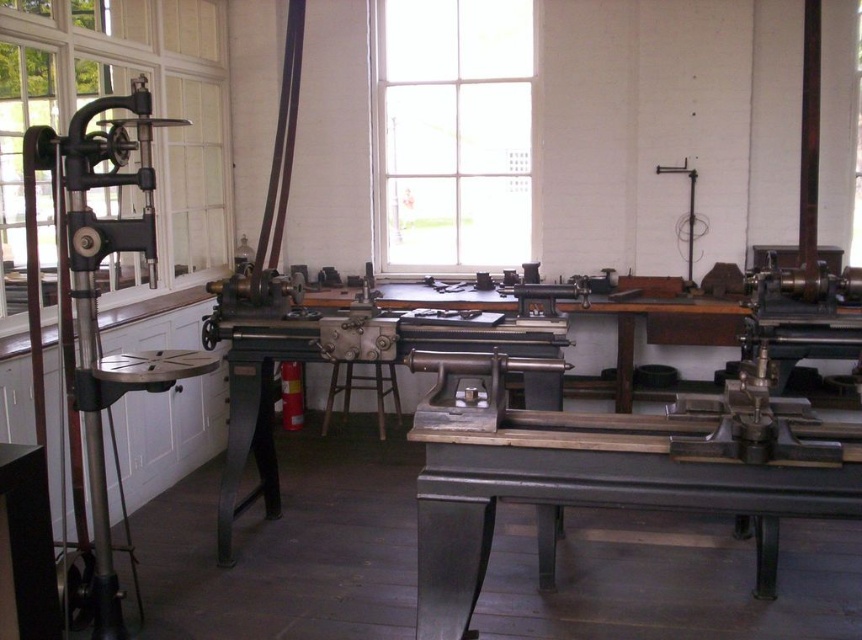
Question: Is clear glass window at left thinner than metallic gray table at center?

Choices:
 (A) yes
 (B) no

Answer: (A)

Question: Which point appears closest to the camera in this image?

Choices:
 (A) (834, 449)
 (B) (213, 198)
 (C) (83, 336)
 (D) (451, 172)

Answer: (A)

Question: Among these points, which one is farthest from the camera?

Choices:
 (A) (453, 81)
 (B) (113, 621)
 (C) (9, 278)
 (D) (773, 492)

Answer: (A)

Question: Can you confirm if clear glass window at center is positioned to the left of polished metal vise at left?

Choices:
 (A) yes
 (B) no

Answer: (B)

Question: Can you confirm if clear glass window at left is thinner than clear glass window at center?

Choices:
 (A) yes
 (B) no

Answer: (A)

Question: Which object is the closest to the clear glass window at center?

Choices:
 (A) clear glass window at left
 (B) polished metal vise at left
 (C) metallic gray table at center

Answer: (A)